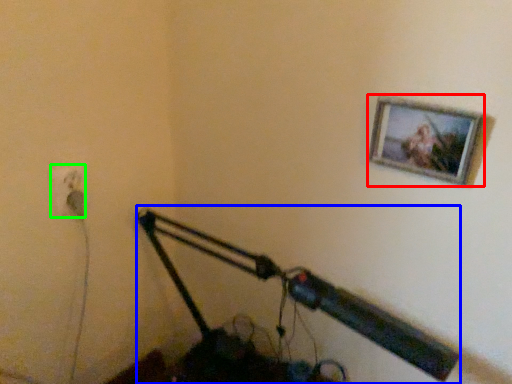
Question: Estimate the real-world distances between objects in this image. Which object is closer to picture frame (highlighted by a red box), lamp (highlighted by a blue box) or electric outlet (highlighted by a green box)?

Choices:
 (A) lamp
 (B) electric outlet

Answer: (A)